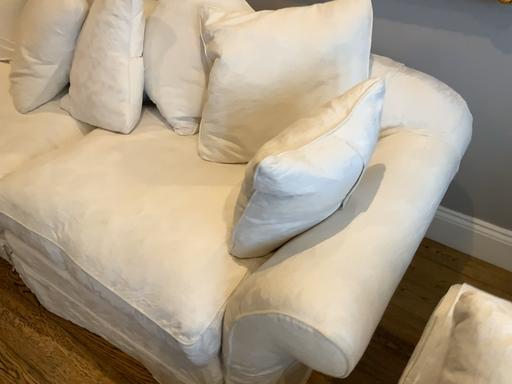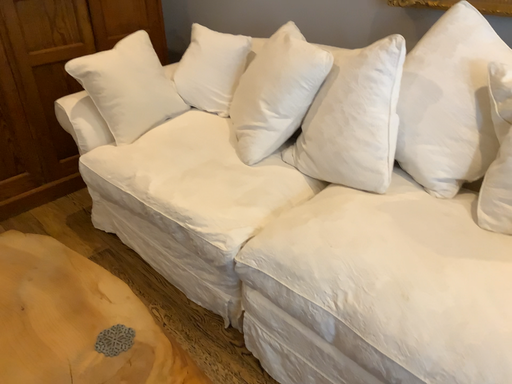
Question: Which way did the camera rotate in the video?

Choices:
 (A) rotated downward
 (B) rotated upward

Answer: (B)